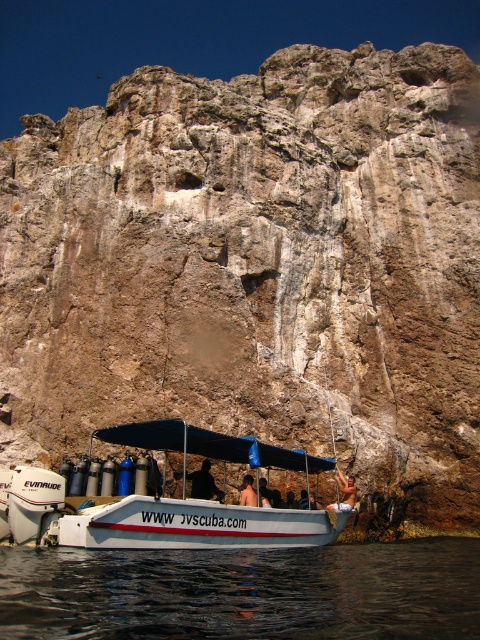
Does black matte person at center appear on the left side of smooth skin person at center?

Yes, black matte person at center is to the left of smooth skin person at center.

Is black matte person at center smaller than smooth skin person at center?

Yes.

Is point (219, 499) less distant than point (336, 502)?

Yes, point (219, 499) is in front of point (336, 502).

Locate an element on the screen. This screenshot has width=480, height=640. black matte person at center is located at coordinates (204, 483).

Who is positioned more to the right, transparent water at lower center or black matte person at center?

Positioned to the right is transparent water at lower center.

Is transparent water at lower center above black matte person at center?

No.

Where is `transparent water at lower center`? This screenshot has width=480, height=640. transparent water at lower center is located at coordinates (243, 593).

Locate an element on the screen. transparent water at lower center is located at coordinates (243, 593).

Who is taller, white matte boat at lower center or smooth skin person at center?

Standing taller between the two is white matte boat at lower center.

What do you see at coordinates (172, 500) in the screenshot? I see `white matte boat at lower center` at bounding box center [172, 500].

Find the location of a particular element. white matte boat at lower center is located at coordinates (172, 500).

At what (x,y) coordinates should I click in order to perform the action: click on white matte boat at lower center. Please return your answer as a coordinate pair (x, y). The height and width of the screenshot is (640, 480). Looking at the image, I should click on (x=172, y=500).